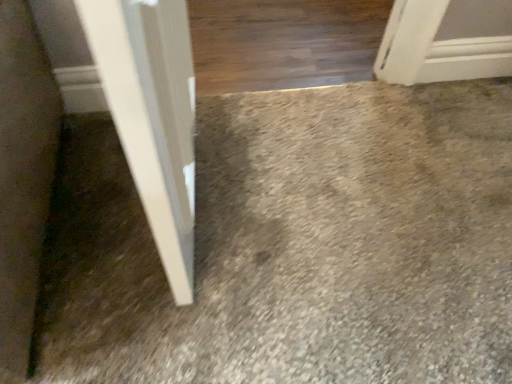
What do you see at coordinates (152, 116) in the screenshot? The image size is (512, 384). I see `white matte door at left` at bounding box center [152, 116].

Locate an element on the screen. This screenshot has height=384, width=512. white matte door at left is located at coordinates (152, 116).

What is the approximate width of white matte door at left?

It is 22.25 centimeters.

The image size is (512, 384). I want to click on white matte door at left, so click(x=152, y=116).